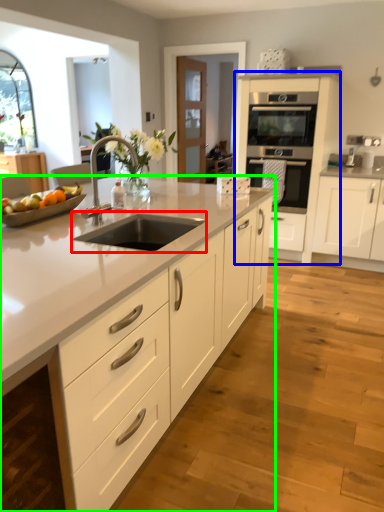
Question: Which object is the closest to the open (highlighted by a red box)? Choose among these: cabinetry (highlighted by a blue box) or countertop (highlighted by a green box).

Choices:
 (A) cabinetry
 (B) countertop

Answer: (B)